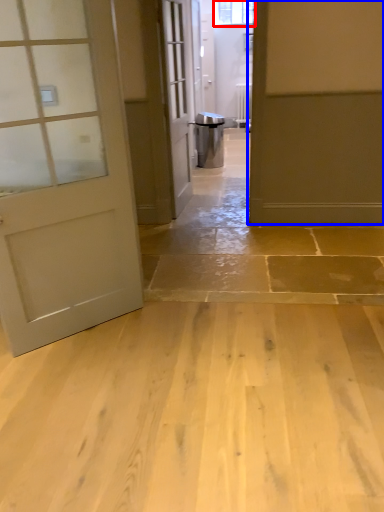
Question: Among these objects, which one is nearest to the camera, window (highlighted by a red box) or door (highlighted by a blue box)?

Choices:
 (A) window
 (B) door

Answer: (B)